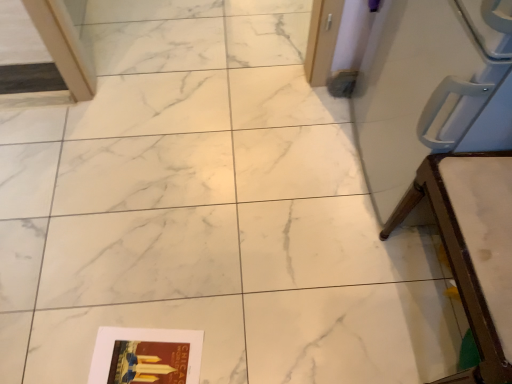
Question: Should I look upward or downward to see white plastic chair at right?

Choices:
 (A) down
 (B) up

Answer: (A)

Question: Would you say matte paper magazine at lower left is part of white plastic chair at right's contents?

Choices:
 (A) no
 (B) yes

Answer: (A)

Question: Is white plastic chair at right at the left side of matte paper magazine at lower left?

Choices:
 (A) no
 (B) yes

Answer: (A)

Question: Can we say white plastic chair at right lies outside matte paper magazine at lower left?

Choices:
 (A) yes
 (B) no

Answer: (A)

Question: From a real-world perspective, is white plastic chair at right positioned over matte paper magazine at lower left based on gravity?

Choices:
 (A) no
 (B) yes

Answer: (B)

Question: Is white plastic chair at right smaller than matte paper magazine at lower left?

Choices:
 (A) no
 (B) yes

Answer: (A)

Question: Could you tell me if white plastic chair at right is facing matte paper magazine at lower left?

Choices:
 (A) yes
 (B) no

Answer: (A)

Question: Can you confirm if matte paper magazine at lower left is smaller than white plastic chair at right?

Choices:
 (A) no
 (B) yes

Answer: (B)

Question: Is matte paper magazine at lower left positioned before white plastic chair at right?

Choices:
 (A) yes
 (B) no

Answer: (B)

Question: Could you tell me if matte paper magazine at lower left is facing white plastic chair at right?

Choices:
 (A) no
 (B) yes

Answer: (A)

Question: Considering the relative sizes of matte paper magazine at lower left and white plastic chair at right in the image provided, is matte paper magazine at lower left shorter than white plastic chair at right?

Choices:
 (A) no
 (B) yes

Answer: (B)

Question: From the image's perspective, does matte paper magazine at lower left appear lower than white plastic chair at right?

Choices:
 (A) no
 (B) yes

Answer: (B)

Question: Considering the relative sizes of matte paper magazine at lower left and white plastic chair at right in the image provided, is matte paper magazine at lower left wider than white plastic chair at right?

Choices:
 (A) yes
 (B) no

Answer: (B)

Question: Do you think white plastic chair at right is within matte paper magazine at lower left, or outside of it?

Choices:
 (A) inside
 (B) outside

Answer: (B)